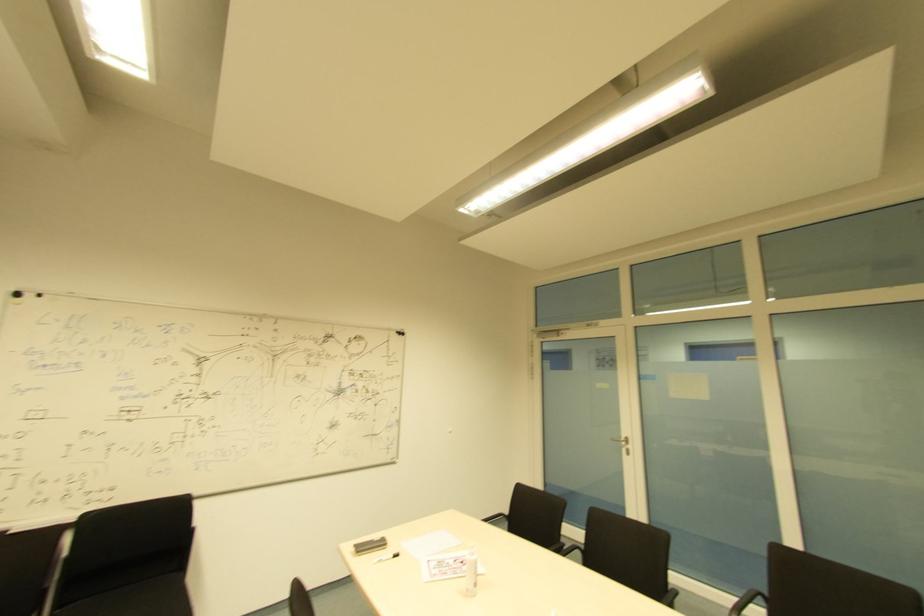
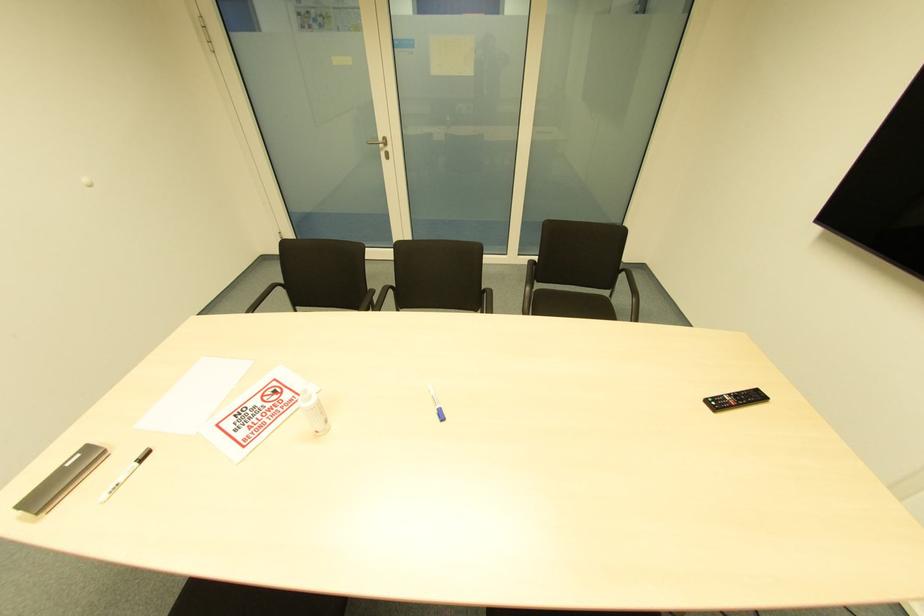
First-person continuous shooting, in which direction is the camera rotating?

The rotation direction of the camera is right-down.